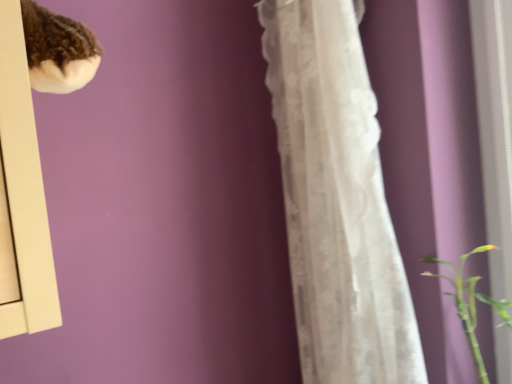
Image resolution: width=512 pixels, height=384 pixels. Describe the element at coordinates (336, 199) in the screenshot. I see `white lace curtain at center` at that location.

Where is `white lace curtain at center`? white lace curtain at center is located at coordinates (336, 199).

Locate an element on the screen. green smooth stem at lower right is located at coordinates (470, 303).

Image resolution: width=512 pixels, height=384 pixels. Describe the element at coordinates (470, 303) in the screenshot. I see `green smooth stem at lower right` at that location.

Image resolution: width=512 pixels, height=384 pixels. What are the coordinates of `white lace curtain at center` in the screenshot? It's located at (336, 199).

Between green smooth stem at lower right and white lace curtain at center, which one appears on the left side from the viewer's perspective?

From the viewer's perspective, white lace curtain at center appears more on the left side.

Considering their positions, is green smooth stem at lower right located in front of or behind white lace curtain at center?

In the image, green smooth stem at lower right appears behind white lace curtain at center.

Considering the positions of points (441, 274) and (394, 288), is point (441, 274) farther from camera compared to point (394, 288)?

Yes, point (441, 274) is behind point (394, 288).

From the image's perspective, which object appears higher, green smooth stem at lower right or white lace curtain at center?

From the image's view, white lace curtain at center is above.

From the picture: From a real-world perspective, between green smooth stem at lower right and white lace curtain at center, who is vertically higher?

From a 3D spatial view, white lace curtain at center is above.

Considering the relative sizes of green smooth stem at lower right and white lace curtain at center in the image provided, is green smooth stem at lower right wider than white lace curtain at center?

In fact, green smooth stem at lower right might be narrower than white lace curtain at center.

Considering the relative sizes of green smooth stem at lower right and white lace curtain at center in the image provided, is green smooth stem at lower right taller than white lace curtain at center?

Incorrect, the height of green smooth stem at lower right is not larger of that of white lace curtain at center.

Considering the sizes of objects green smooth stem at lower right and white lace curtain at center in the image provided, who is smaller, green smooth stem at lower right or white lace curtain at center?

green smooth stem at lower right.

Is white lace curtain at center surrounded by green smooth stem at lower right?

Actually, white lace curtain at center is outside green smooth stem at lower right.

Is green smooth stem at lower right not near white lace curtain at center?

No, green smooth stem at lower right is in close proximity to white lace curtain at center.

Does green smooth stem at lower right turn towards white lace curtain at center?

No, green smooth stem at lower right is not oriented towards white lace curtain at center.

Measure the distance from green smooth stem at lower right to white lace curtain at center.

green smooth stem at lower right and white lace curtain at center are 11.07 inches apart.

Image resolution: width=512 pixels, height=384 pixels. I want to click on curtain that appears above the green smooth stem at lower right (from the image's perspective), so [x=336, y=199].

Considering the relative positions of white lace curtain at center and green smooth stem at lower right in the image provided, is white lace curtain at center to the left or to the right of green smooth stem at lower right?

white lace curtain at center is positioned on green smooth stem at lower right's left side.

Which object is closer to the camera taking this photo, white lace curtain at center or green smooth stem at lower right?

white lace curtain at center is more forward.

Which point is more distant from viewer, [369,176] or [483,245]?

The point [483,245] is behind.

From the image's perspective, is white lace curtain at center above green smooth stem at lower right?

Yes, from the image's perspective, white lace curtain at center is over green smooth stem at lower right.

From a real-world perspective, is white lace curtain at center positioned under green smooth stem at lower right based on gravity?

No, from a real-world perspective, white lace curtain at center is not below green smooth stem at lower right.

Considering the relative sizes of white lace curtain at center and green smooth stem at lower right in the image provided, is white lace curtain at center wider than green smooth stem at lower right?

Yes, white lace curtain at center is wider than green smooth stem at lower right.

Is white lace curtain at center taller than green smooth stem at lower right?

Yes.

Between white lace curtain at center and green smooth stem at lower right, which one has smaller size?

green smooth stem at lower right.

Which is correct: white lace curtain at center is inside green smooth stem at lower right, or outside of it?

white lace curtain at center is located beyond the bounds of green smooth stem at lower right.

Is white lace curtain at center positioned far away from green smooth stem at lower right?

white lace curtain at center is actually quite close to green smooth stem at lower right.

Does white lace curtain at center turn towards green smooth stem at lower right?

No, white lace curtain at center is not aimed at green smooth stem at lower right.

Locate an element on the screen. curtain in front of the green smooth stem at lower right is located at coordinates pyautogui.click(x=336, y=199).

Find the location of a particular element. orchid below the white lace curtain at center (from the image's perspective) is located at coordinates (470, 303).

The image size is (512, 384). I want to click on orchid that is on the right side of white lace curtain at center, so click(x=470, y=303).